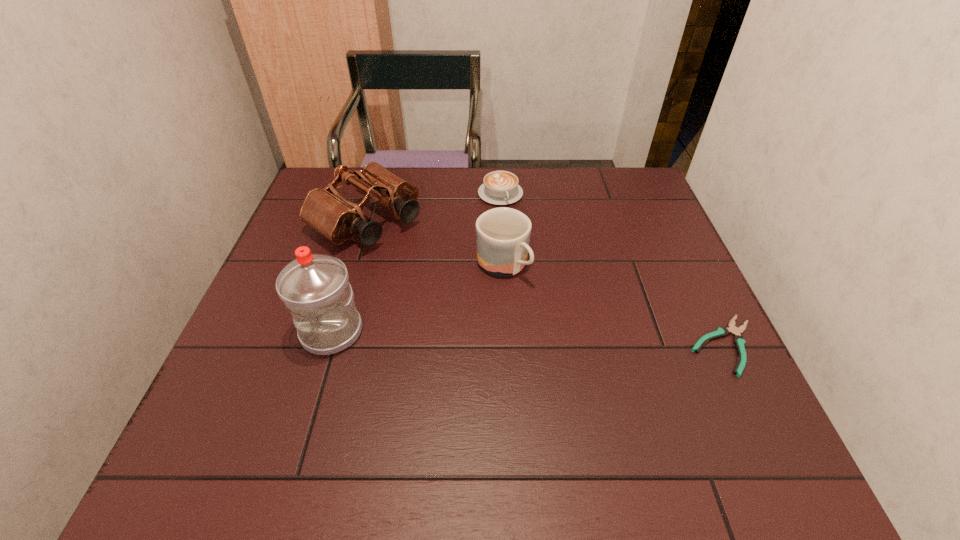
In order to click on water bottle in this screenshot , I will do (315, 288).

The width and height of the screenshot is (960, 540). Find the location of `the rightmost object`. the rightmost object is located at coordinates (739, 341).

This screenshot has width=960, height=540. Find the location of `the shortest object`. the shortest object is located at coordinates (739, 341).

What are the coordinates of `the second tallest object` in the screenshot? It's located at (325, 210).

You are a GUI agent. You are given a task and a screenshot of the screen. Output one action in this format:
    pyautogui.click(x=<x>, y=<y>)
    Task: Click on the third tallest object
    The width and height of the screenshot is (960, 540).
    Given the screenshot: What is the action you would take?
    pyautogui.click(x=503, y=234)

Find the location of `the fourth tallest object`. the fourth tallest object is located at coordinates (500, 187).

Locate an element on the screen. vacant space situated 0.110m on the handle side of the water bottle is located at coordinates (310, 405).

In order to click on free spot located on the left of the shortest object in this screenshot , I will do `click(549, 346)`.

Locate an element on the screen. Image resolution: width=960 pixels, height=540 pixels. blank space located 0.330m through the eyepieces of the binoculars is located at coordinates (494, 308).

Find the location of a particular element. blank area located 0.160m through the eyepieces of the binoculars is located at coordinates (444, 273).